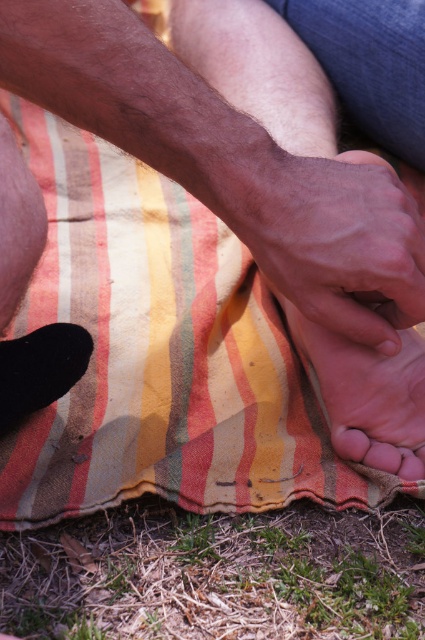
Question: Which object is the closest to the pink soft skin at center?

Choices:
 (A) green grass at lower center
 (B) matte brown toe at lower center
 (C) dry skin at center

Answer: (B)

Question: Does dry skin at center have a larger size compared to smooth pink toe at lower right?

Choices:
 (A) yes
 (B) no

Answer: (A)

Question: Which point is farther to the camera?

Choices:
 (A) smooth pink toe at lower right
 (B) pink smooth toe at center
 (C) pink smooth foot at lower center
 (D) pink soft skin at center

Answer: (A)

Question: Does pink smooth foot at lower center lie behind matte brown toe at lower center?

Choices:
 (A) no
 (B) yes

Answer: (B)

Question: Is pink smooth foot at lower center to the left of pink smooth toe at center from the viewer's perspective?

Choices:
 (A) yes
 (B) no

Answer: (A)

Question: Which point is closer to the camera?

Choices:
 (A) dry skin at center
 (B) matte brown toe at lower center

Answer: (A)